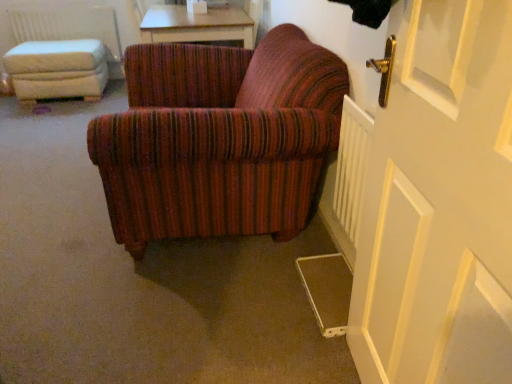
Question: From the image's perspective, is white wooden door at right under white fabric radiator at upper left, marked as the second radiator in a bottom-to-top arrangement?

Choices:
 (A) no
 (B) yes

Answer: (B)

Question: Does white wooden door at right turn towards white fabric radiator at upper left, the second radiator from the front?

Choices:
 (A) no
 (B) yes

Answer: (A)

Question: Does white wooden door at right have a lesser height compared to white fabric radiator at upper left, which is counted as the 1th radiator, starting from the left?

Choices:
 (A) no
 (B) yes

Answer: (A)

Question: Is white wooden door at right closer to the viewer compared to white fabric radiator at upper left, which is the 2th radiator from right to left?

Choices:
 (A) yes
 (B) no

Answer: (A)

Question: Does white wooden door at right have a lesser width compared to white fabric radiator at upper left, which is counted as the 1th radiator, starting from the left?

Choices:
 (A) yes
 (B) no

Answer: (B)

Question: Which is correct: white plastic radiator at lower right, marked as the second radiator in a back-to-front arrangement, is inside light brown wooden table at upper center, or outside of it?

Choices:
 (A) inside
 (B) outside

Answer: (B)

Question: From the image's perspective, is white plastic radiator at lower right, which appears as the 1th radiator when ordered from the bottom, above or below light brown wooden table at upper center?

Choices:
 (A) above
 (B) below

Answer: (B)

Question: Considering the positions of white plastic radiator at lower right, which is the 2th radiator in top-to-bottom order, and light brown wooden table at upper center in the image, is white plastic radiator at lower right, which is the 2th radiator in top-to-bottom order, taller or shorter than light brown wooden table at upper center?

Choices:
 (A) short
 (B) tall

Answer: (B)

Question: In terms of width, does white plastic radiator at lower right, acting as the 1th radiator starting from the right, look wider or thinner when compared to light brown wooden table at upper center?

Choices:
 (A) wide
 (B) thin

Answer: (B)

Question: In terms of height, does white fabric radiator at upper left, the second radiator from the front, look taller or shorter compared to white wooden door at right?

Choices:
 (A) short
 (B) tall

Answer: (A)

Question: In the image, is white fabric radiator at upper left, marked as the 1th radiator in a top-to-bottom arrangement, positioned in front of or behind white wooden door at right?

Choices:
 (A) front
 (B) behind

Answer: (B)

Question: Is white fabric radiator at upper left, the 1th radiator from the back, spatially inside white wooden door at right, or outside of it?

Choices:
 (A) outside
 (B) inside

Answer: (A)

Question: From a real-world perspective, is white fabric radiator at upper left, the 1th radiator from the back, physically located above or below white wooden door at right?

Choices:
 (A) above
 (B) below

Answer: (B)

Question: From a real-world perspective, is white wooden door at right positioned above or below white plastic radiator at lower right, marked as the second radiator in a back-to-front arrangement?

Choices:
 (A) above
 (B) below

Answer: (A)

Question: From the image's perspective, is white wooden door at right located above or below white plastic radiator at lower right, marked as the second radiator in a back-to-front arrangement?

Choices:
 (A) above
 (B) below

Answer: (B)